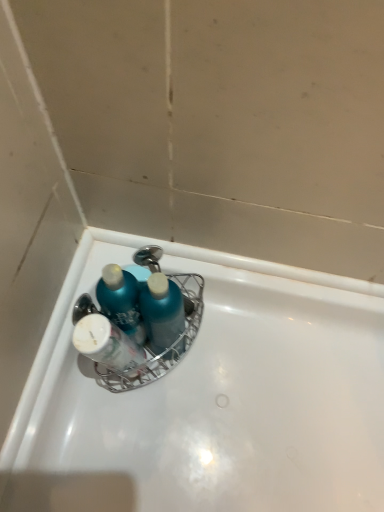
Question: In the image, is white glossy bottle at center positioned in front of or behind blue glossy bottle at upper center?

Choices:
 (A) behind
 (B) front

Answer: (B)

Question: From a real-world perspective, is white glossy bottle at center above or below blue glossy bottle at upper center?

Choices:
 (A) above
 (B) below

Answer: (A)

Question: Considering the real-world distances, which object is closest to the blue glossy bottle at upper center?

Choices:
 (A) white glossy bottle at center
 (B) white glossy bathtub at center

Answer: (A)

Question: Which of these objects is positioned farthest from the white glossy bottle at center?

Choices:
 (A) blue glossy bottle at upper center
 (B) white glossy bathtub at center

Answer: (B)